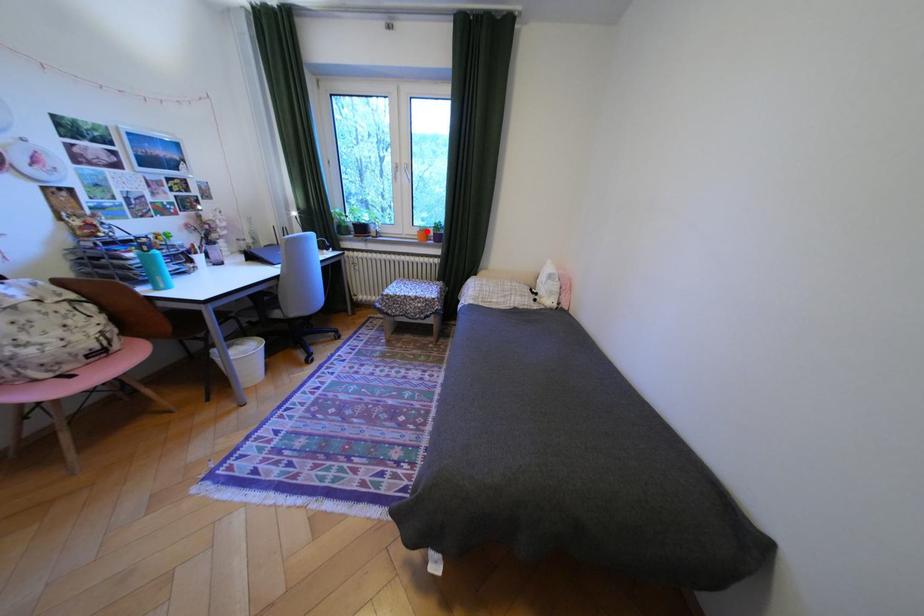
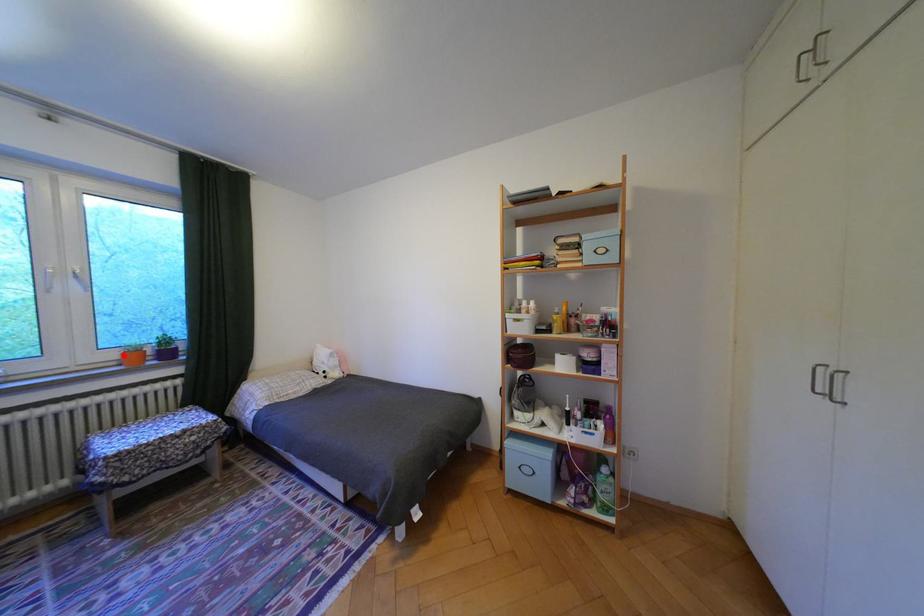
I am providing you with two images of the same scene from different viewpoints. A red point is marked on the first image and another point is marked on the second image. Does the point marked in image1 correspond to the same location as the one in image2?

Yes